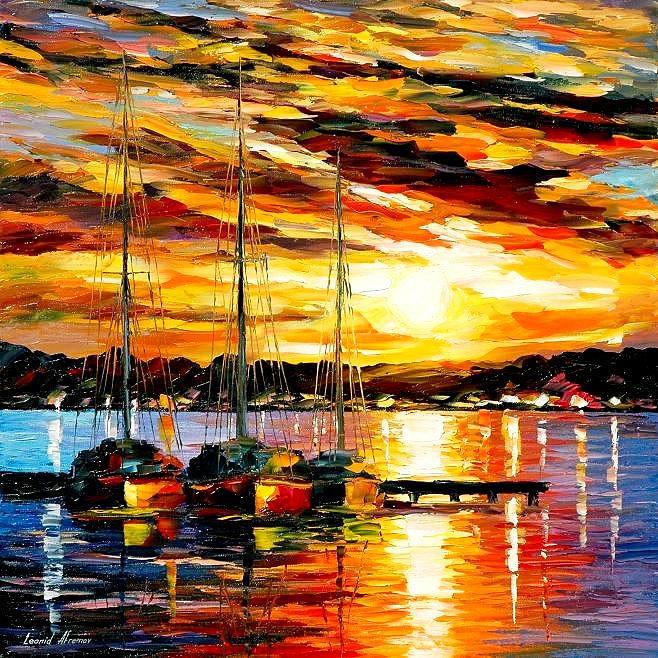
Find the location of a particular element. The height and width of the screenshot is (658, 658). board is located at coordinates (528, 507), (490, 501), (451, 505), (405, 505), (465, 490).